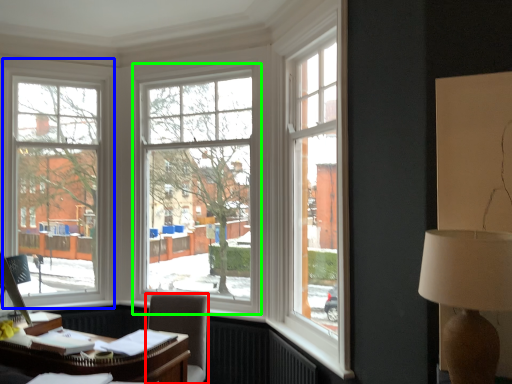
Question: Which object is positioned farthest from chair (highlighted by a red box)? Select from window (highlighted by a blue box) and window (highlighted by a green box).

Choices:
 (A) window
 (B) window

Answer: (A)